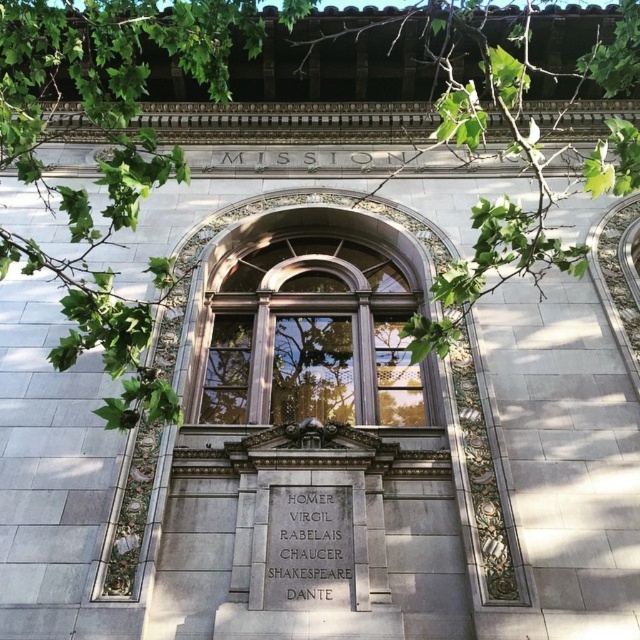
Does wooden window at center have a greater width compared to gray stone plaque at center?

Yes.

Does wooden window at center come behind gray stone plaque at center?

Yes.

You are a GUI agent. You are given a task and a screenshot of the screen. Output one action in this format:
    pyautogui.click(x=<x>, y=<y>)
    Task: Click on the wooden window at center
    This screenshot has height=640, width=640.
    Given the screenshot: What is the action you would take?
    pyautogui.click(x=307, y=337)

Is green leafy branches at upper center above wooden window at center?

Yes, green leafy branches at upper center is above wooden window at center.

In the scene shown: Is green leafy branches at upper center smaller than wooden window at center?

No, green leafy branches at upper center is not smaller than wooden window at center.

Identify the location of green leafy branches at upper center. The width and height of the screenshot is (640, 640). (108, 157).

Locate an element on the screen. The image size is (640, 640). green leafy branches at upper center is located at coordinates (108, 157).

Who is taller, green leafy branches at upper center or gray stone plaque at center?

green leafy branches at upper center is taller.

Is green leafy branches at upper center in front of gray stone plaque at center?

Yes, green leafy branches at upper center is closer to the viewer.

At what (x,y) coordinates should I click in order to perform the action: click on green leafy branches at upper center. Please return your answer as a coordinate pair (x, y). The image size is (640, 640). Looking at the image, I should click on (108, 157).